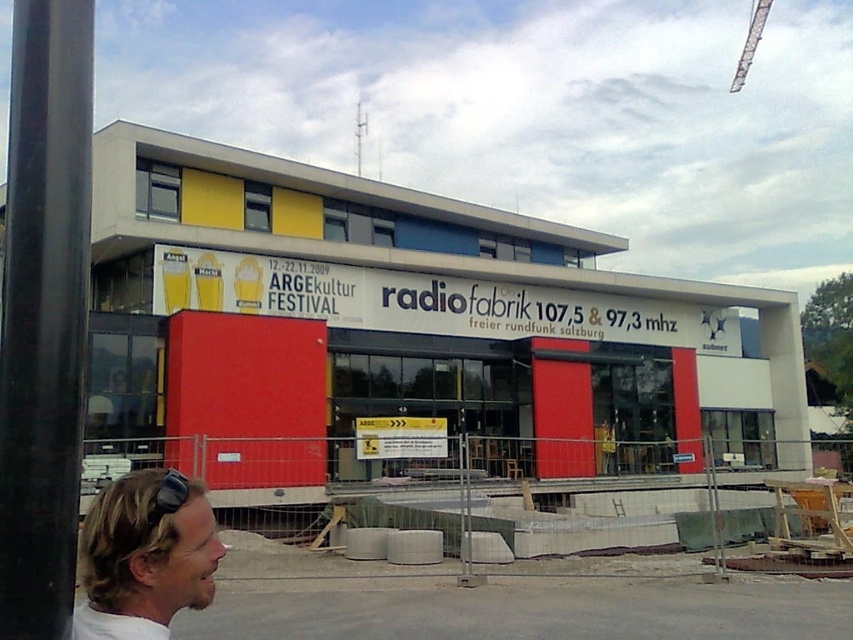
Question: Which of the following is the farthest from the observer?

Choices:
 (A) (68, 77)
 (B) (125, 595)

Answer: (A)

Question: Does black metal pole at left appear on the left side of metallic silver crane at upper right?

Choices:
 (A) no
 (B) yes

Answer: (B)

Question: Where is black metal pole at left located in relation to white matte shirt at lower left in the image?

Choices:
 (A) above
 (B) below

Answer: (A)

Question: Which of the following is the farthest from the observer?

Choices:
 (A) metallic silver crane at upper right
 (B) black metal pole at left

Answer: (A)

Question: Which object appears closest to the camera in this image?

Choices:
 (A) white matte shirt at lower left
 (B) black metal pole at left
 (C) metallic silver crane at upper right

Answer: (A)

Question: Can you confirm if black metal pole at left is positioned to the right of white matte shirt at lower left?

Choices:
 (A) no
 (B) yes

Answer: (A)